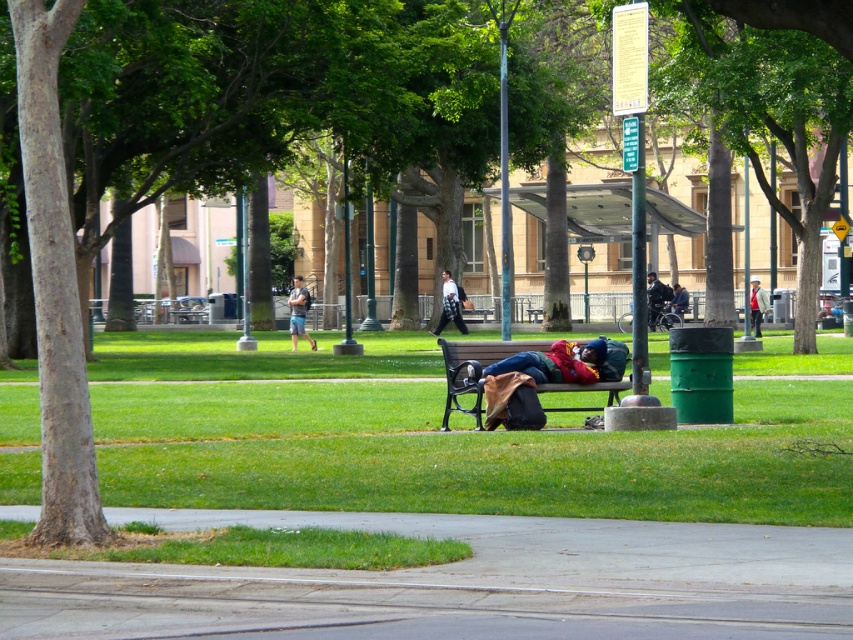
You are a park security guard who notices two jackets left unattended on the bench in the park. The jackets are the dark blue jacket at center and the light brown leather jacket at center. Which jacket is on top?

The light brown leather jacket at center is on top of the dark blue jacket at center.

You are standing at the point with coordinates point [282,582] and want to walk to the point with coordinates point [120,337]. Is there any obstruction between you and your destination?

Point [120,337] is behind point [282,582], so there is an obstruction between them.